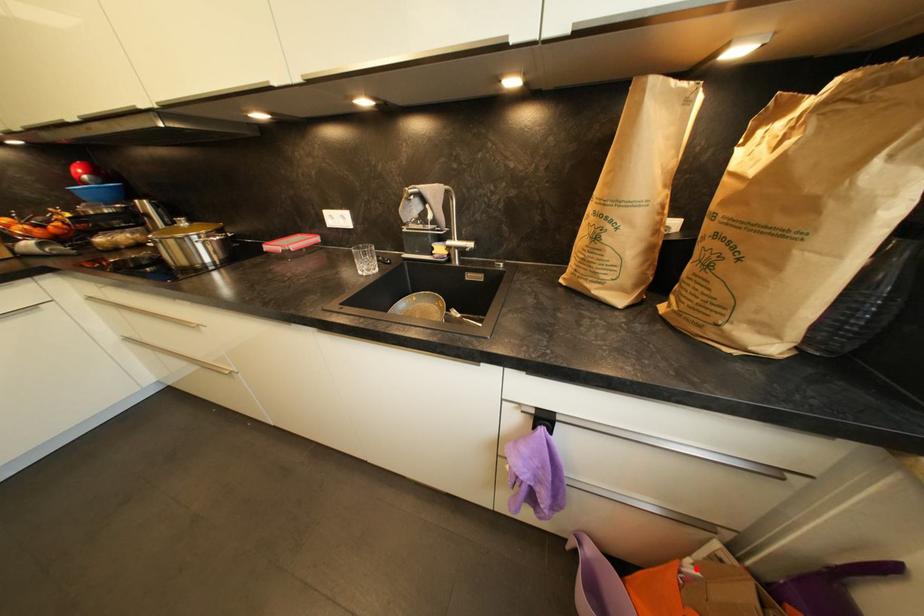
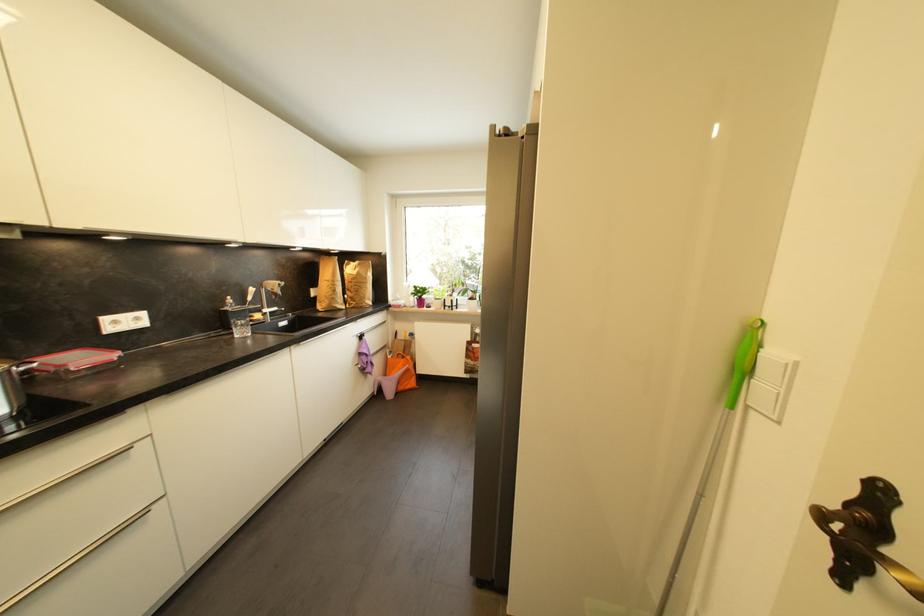
The point at the highlighted location is marked in the first image. Where is the corresponding point in the second image?

(395, 359)